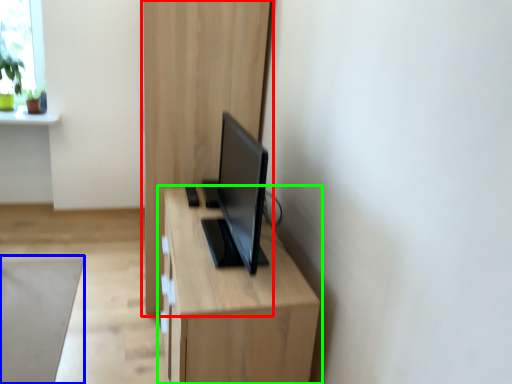
Question: Which object is the closest to the dresser (highlighted by a red box)? Choose among these: plain (highlighted by a blue box) or table (highlighted by a green box).

Choices:
 (A) plain
 (B) table

Answer: (B)